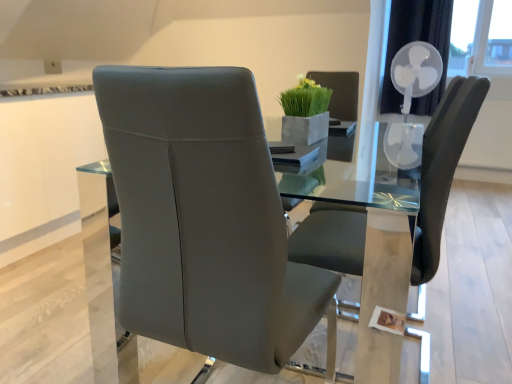
Measure the distance between white plastic fan at upper right and camera.

white plastic fan at upper right is 3.45 meters from camera.

You are a GUI agent. You are given a task and a screenshot of the screen. Output one action in this format:
    pyautogui.click(x=<x>, y=<y>)
    Task: Click on the green matte vase at upper center
    The image size is (512, 384).
    Given the screenshot: What is the action you would take?
    pyautogui.click(x=305, y=112)

The image size is (512, 384). Describe the element at coordinates (205, 219) in the screenshot. I see `satin grey leather chair at center, the first chair from the left` at that location.

The width and height of the screenshot is (512, 384). In order to click on white plastic fan at upper right in this screenshot , I will do point(411,100).

From the image's perspective, is green matte vase at upper center below white plastic fan at upper right?

Indeed, from the image's perspective, green matte vase at upper center is shown beneath white plastic fan at upper right.

Is the surface of green matte vase at upper center in direct contact with white plastic fan at upper right?

There is a gap between green matte vase at upper center and white plastic fan at upper right.

Consider the image. Is white plastic fan at upper right at the back of green matte vase at upper center?

No.

Between white plastic fan at upper right and matte gray chair at center, the 2th chair positioned from the left, which one appears on the left side from the viewer's perspective?

From the viewer's perspective, matte gray chair at center, the 2th chair positioned from the left, appears more on the left side.

Is matte gray chair at center, the 2th chair positioned from the left, inside white plastic fan at upper right?

No.

Where is `fan that appears behind the matte gray chair at center, marked as the 1th chair in a right-to-left arrangement`? Image resolution: width=512 pixels, height=384 pixels. fan that appears behind the matte gray chair at center, marked as the 1th chair in a right-to-left arrangement is located at coordinates (411, 100).

From the image's perspective, is white plastic fan at upper right on matte gray chair at center, the 2th chair positioned from the left?

Indeed, from the image's perspective, white plastic fan at upper right is shown above matte gray chair at center, the 2th chair positioned from the left.

Between point (484, 84) and point (156, 302), which one is positioned in front?

Point (156, 302)

From a real-world perspective, is matte gray chair at center, the 2th chair positioned from the left, on top of satin grey leather chair at center, the first chair from the left?

No, from a real-world perspective, matte gray chair at center, the 2th chair positioned from the left, is not over satin grey leather chair at center, the first chair from the left

Does matte gray chair at center, the 2th chair positioned from the left, have a smaller size compared to satin grey leather chair at center, the first chair from the left?

No, matte gray chair at center, the 2th chair positioned from the left, is not smaller than satin grey leather chair at center, the first chair from the left.

In terms of height, does matte gray chair at center, marked as the 1th chair in a right-to-left arrangement, look taller or shorter compared to satin grey leather chair at center, the first chair from the left?

Considering their sizes, matte gray chair at center, marked as the 1th chair in a right-to-left arrangement, has more height than satin grey leather chair at center, the first chair from the left.

This screenshot has height=384, width=512. In order to click on chair lying on the left of green matte vase at upper center in this screenshot , I will do `click(205, 219)`.

Between green matte vase at upper center and satin grey leather chair at center, which is counted as the 2th chair, starting from the right, which one has smaller width?

green matte vase at upper center is thinner.

Is green matte vase at upper center facing away from satin grey leather chair at center, the first chair from the left?

That's not correct — green matte vase at upper center is not looking away from satin grey leather chair at center, the first chair from the left.

Between green matte vase at upper center and satin grey leather chair at center, which is counted as the 2th chair, starting from the right, which one appears on the right side from the viewer's perspective?

From the viewer's perspective, green matte vase at upper center appears more on the right side.

In the scene shown: Does white plastic fan at upper right turn towards green matte vase at upper center?

Yes, white plastic fan at upper right is oriented towards green matte vase at upper center.

From a real-world perspective, is white plastic fan at upper right below green matte vase at upper center?

Yes, from a real-world perspective, white plastic fan at upper right is under green matte vase at upper center.

From the image's perspective, would you say white plastic fan at upper right is shown under green matte vase at upper center?

No, from the image's perspective, white plastic fan at upper right is not beneath green matte vase at upper center.

Between white plastic fan at upper right and green matte vase at upper center, which one has less height?

Standing shorter between the two is green matte vase at upper center.

Can you tell me how much matte gray chair at center, marked as the 1th chair in a right-to-left arrangement, and white plastic fan at upper right differ in facing direction?

They differ by 90.8 degrees in their facing directions.

Is matte gray chair at center, the 2th chair positioned from the left, facing towards white plastic fan at upper right?

No, matte gray chair at center, the 2th chair positioned from the left, is not facing towards white plastic fan at upper right.

Based on their positions, is matte gray chair at center, marked as the 1th chair in a right-to-left arrangement, located to the left or right of white plastic fan at upper right?

From the image, it's evident that matte gray chair at center, marked as the 1th chair in a right-to-left arrangement, is to the left of white plastic fan at upper right.

Which of these two, matte gray chair at center, the 2th chair positioned from the left, or white plastic fan at upper right, is thinner?

With smaller width is white plastic fan at upper right.

Is matte gray chair at center, marked as the 1th chair in a right-to-left arrangement, at the back of green matte vase at upper center?

No, green matte vase at upper center is not facing the opposite direction of matte gray chair at center, marked as the 1th chair in a right-to-left arrangement.

What's the angular difference between green matte vase at upper center and matte gray chair at center, marked as the 1th chair in a right-to-left arrangement,'s facing directions?

175 degrees separate the facing orientations of green matte vase at upper center and matte gray chair at center, marked as the 1th chair in a right-to-left arrangement.

From a real-world perspective, which object rests below the other?

matte gray chair at center, the 2th chair positioned from the left, from a real-world perspective.

Do you think green matte vase at upper center is within matte gray chair at center, the 2th chair positioned from the left, or outside of it?

green matte vase at upper center is spatially situated outside matte gray chair at center, the 2th chair positioned from the left.

Where is `houseplant on the left side of white plastic fan at upper right`? This screenshot has height=384, width=512. houseplant on the left side of white plastic fan at upper right is located at coordinates (305, 112).

I want to click on fan above the matte gray chair at center, the 2th chair positioned from the left (from a real-world perspective), so click(411, 100).

From the image, which object appears to be farther from green matte vase at upper center, satin grey leather chair at center, which is counted as the 2th chair, starting from the right, or white plastic fan at upper right?

Based on the image, white plastic fan at upper right appears to be further to green matte vase at upper center.

Based on their spatial positions, is satin grey leather chair at center, which is counted as the 2th chair, starting from the right, or matte gray chair at center, the 2th chair positioned from the left, further from white plastic fan at upper right?

satin grey leather chair at center, which is counted as the 2th chair, starting from the right, lies further to white plastic fan at upper right than the other object.

From the image, which object appears to be nearer to matte gray chair at center, marked as the 1th chair in a right-to-left arrangement, white plastic fan at upper right or satin grey leather chair at center, the first chair from the left?

satin grey leather chair at center, the first chair from the left, is positioned closer to the anchor matte gray chair at center, marked as the 1th chair in a right-to-left arrangement.

Considering their positions, is white plastic fan at upper right positioned closer to satin grey leather chair at center, which is counted as the 2th chair, starting from the right, than green matte vase at upper center?

green matte vase at upper center is closer to satin grey leather chair at center, which is counted as the 2th chair, starting from the right.

Looking at this image, estimate the real-world distances between objects in this image. Which object is further from satin grey leather chair at center, which is counted as the 2th chair, starting from the right, white plastic fan at upper right or matte gray chair at center, marked as the 1th chair in a right-to-left arrangement?

white plastic fan at upper right is positioned further to the anchor satin grey leather chair at center, which is counted as the 2th chair, starting from the right.

Based on their spatial positions, is green matte vase at upper center or white plastic fan at upper right closer to satin grey leather chair at center, which is counted as the 2th chair, starting from the right?

green matte vase at upper center lies closer to satin grey leather chair at center, which is counted as the 2th chair, starting from the right, than the other object.

Estimate the real-world distances between objects in this image. Which object is further from white plastic fan at upper right, satin grey leather chair at center, which is counted as the 2th chair, starting from the right, or green matte vase at upper center?

The object further to white plastic fan at upper right is satin grey leather chair at center, which is counted as the 2th chair, starting from the right.

Based on their spatial positions, is green matte vase at upper center or satin grey leather chair at center, the first chair from the left, closer to matte gray chair at center, the 2th chair positioned from the left?

green matte vase at upper center is closer to matte gray chair at center, the 2th chair positioned from the left.

Find the location of `chair positioned between satin grey leather chair at center, the first chair from the left, and green matte vase at upper center from near to far`. chair positioned between satin grey leather chair at center, the first chair from the left, and green matte vase at upper center from near to far is located at coordinates (442, 173).

Locate an element on the screen. Image resolution: width=512 pixels, height=384 pixels. chair between satin grey leather chair at center, the first chair from the left, and white plastic fan at upper right in the front-back direction is located at coordinates (442, 173).

Where is `houseplant located between satin grey leather chair at center, the first chair from the left, and white plastic fan at upper right in the depth direction`? houseplant located between satin grey leather chair at center, the first chair from the left, and white plastic fan at upper right in the depth direction is located at coordinates (305, 112).

Identify the location of houseplant between matte gray chair at center, the 2th chair positioned from the left, and white plastic fan at upper right, along the z-axis. The image size is (512, 384). (305, 112).